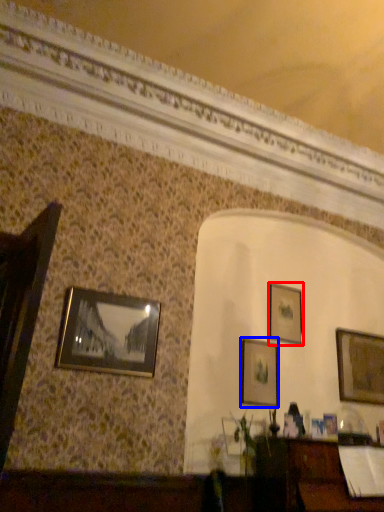
Question: Among these objects, which one is nearest to the camera, picture frame (highlighted by a red box) or picture frame (highlighted by a blue box)?

Choices:
 (A) picture frame
 (B) picture frame

Answer: (B)